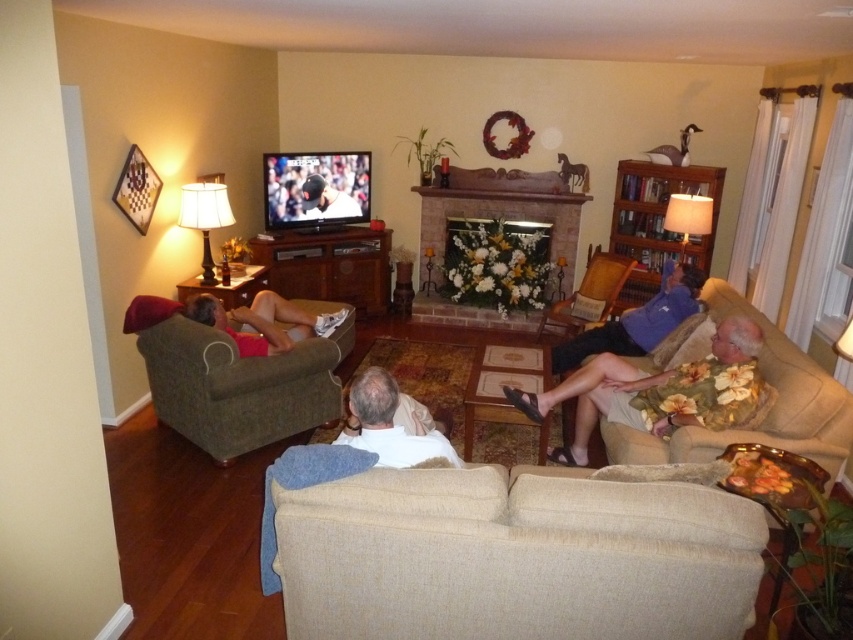
You are sitting on the green fabric armchair at left and want to move to the beige fabric couch at right. Which direction should you move to reach it?

You should move to the right to reach the beige fabric couch at right since the green fabric armchair at left is positioned to the left of it.